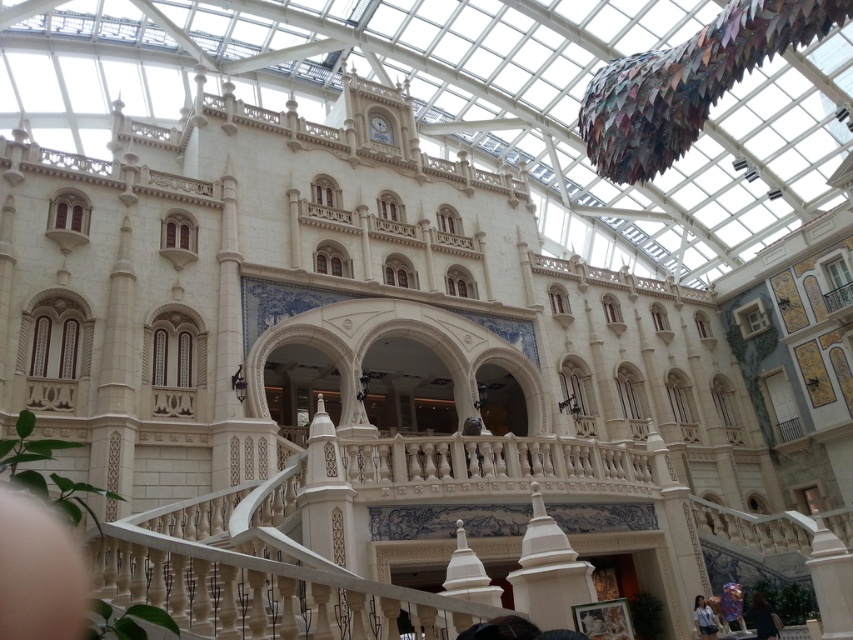
Question: Where is dark brown leather jacket at lower right located in relation to light blue denim shirt at lower right in the image?

Choices:
 (A) left
 (B) right

Answer: (B)

Question: Is dark brown leather jacket at lower right to the left of light blue denim shirt at lower right from the viewer's perspective?

Choices:
 (A) yes
 (B) no

Answer: (B)

Question: Does dark brown leather jacket at lower right have a greater width compared to light blue denim shirt at lower right?

Choices:
 (A) no
 (B) yes

Answer: (B)